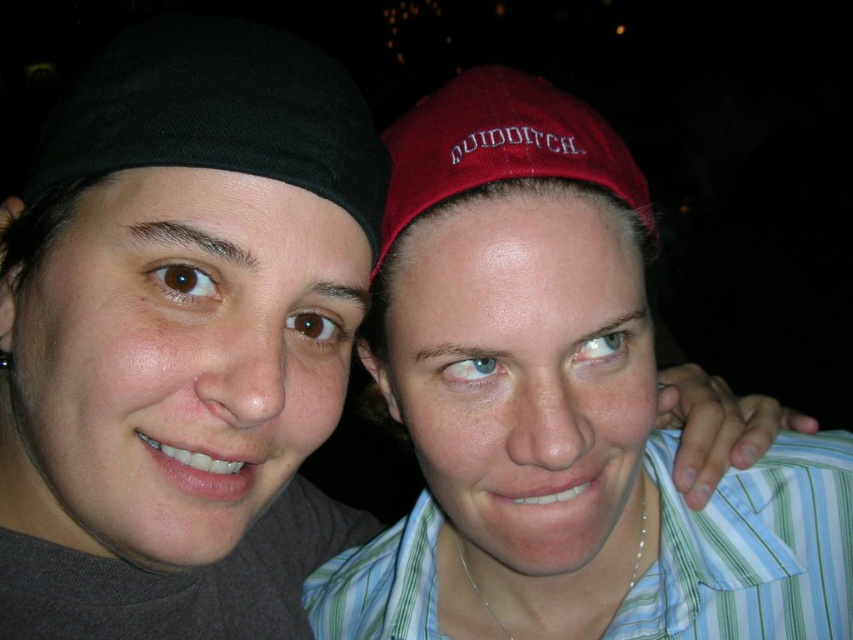
Can you confirm if black fabric headband at left is positioned above burgundy fabric cap at upper center?

Indeed, black fabric headband at left is positioned over burgundy fabric cap at upper center.

Who is more forward, [126,32] or [502,77]?

Point [502,77]

Which is behind, point (90, 124) or point (535, 170)?

Positioned behind is point (90, 124).

You are a GUI agent. You are given a task and a screenshot of the screen. Output one action in this format:
    pyautogui.click(x=<x>, y=<y>)
    Task: Click on the black fabric headband at left
    
    Given the screenshot: What is the action you would take?
    pyautogui.click(x=218, y=115)

Between matte red cap at upper right and burgundy fabric cap at upper center, which one has more height?

Standing taller between the two is matte red cap at upper right.

What do you see at coordinates (556, 410) in the screenshot?
I see `matte red cap at upper right` at bounding box center [556, 410].

Find the location of a particular element. Image resolution: width=853 pixels, height=640 pixels. matte red cap at upper right is located at coordinates (556, 410).

Measure the distance between matte red cap at upper right and black fabric headband at left.

They are 16.70 centimeters apart.

Which is above, matte red cap at upper right or black fabric headband at left?

black fabric headband at left is higher up.

The height and width of the screenshot is (640, 853). In order to click on matte red cap at upper right in this screenshot , I will do `click(556, 410)`.